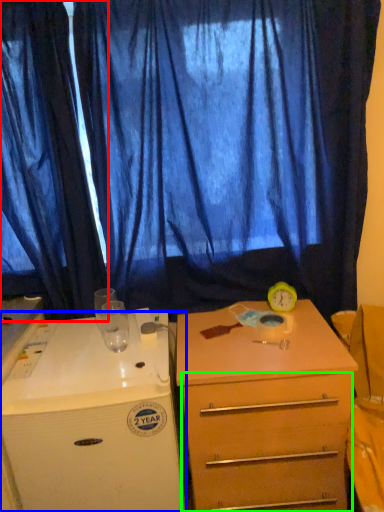
Question: Based on their relative distances, which object is nearer to curtain (highlighted by a red box)? Choose from desk (highlighted by a blue box) and drawer (highlighted by a green box).

Choices:
 (A) desk
 (B) drawer

Answer: (A)